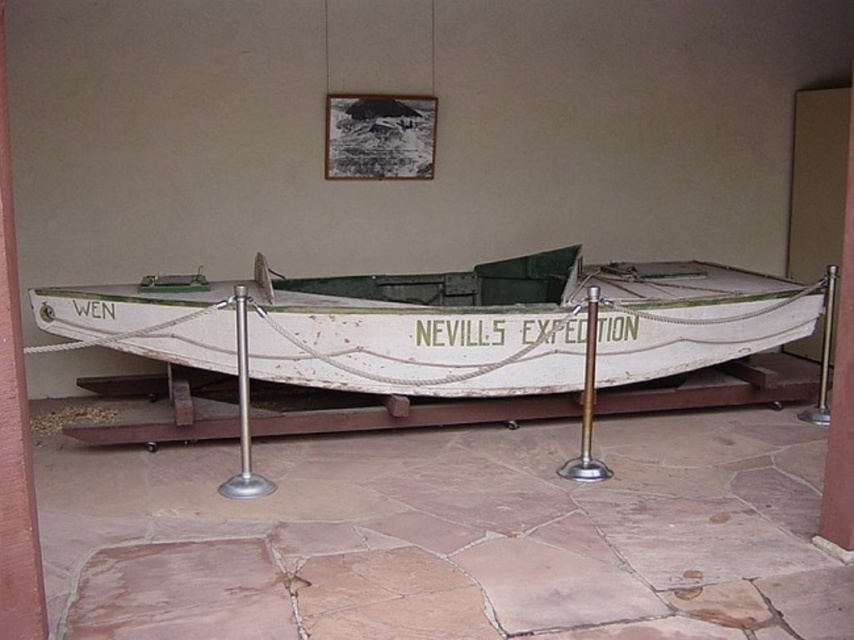
Who is positioned more to the left, white wooden boat at center or silver metallic pole at center?

silver metallic pole at center

Between point (495, 300) and point (237, 492), which one is positioned behind?

The point (495, 300) is more distant.

This screenshot has width=854, height=640. In order to click on white wooden boat at center in this screenshot , I will do `click(518, 324)`.